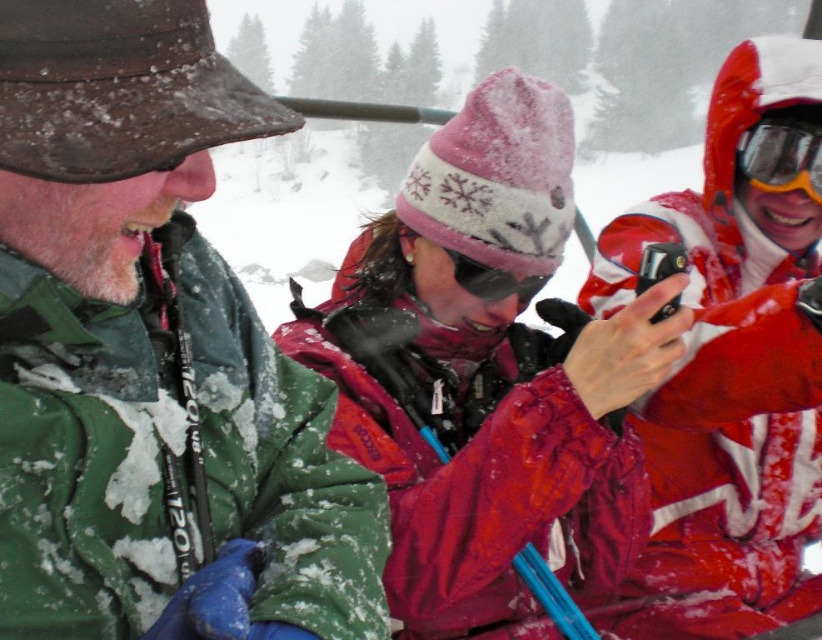
You are a photographer trying to capture a candid shot of the matte red jacket at right and the sunglasses at center. If you want to ensure both subjects are in focus, which one should you adjust your camera focus on first, considering their sizes?

The matte red jacket at right is wider than the sunglasses at center. Therefore, you should focus on the matte red jacket at right first since it occupies more space in the frame, ensuring both are in focus.

You are standing at the center of the snowy landscape and want to take a photo of the matte red jacket at right. In which direction should you move to ensure the jacket is centered in your camera view?

The matte red jacket at right is located at point 0.566 on the x and 0.892 on the y coordinate. Since you are at the center, you should move towards the right and slightly upwards to center the jacket in your camera view.